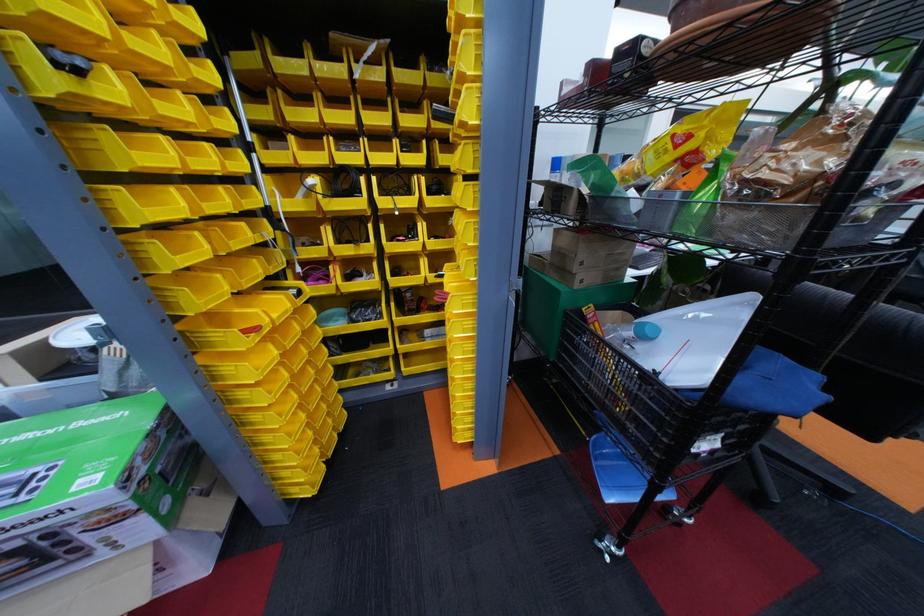
Where would you grasp the chair armrest? Please return your answer as a coordinate pair (x, y).

(849, 355)